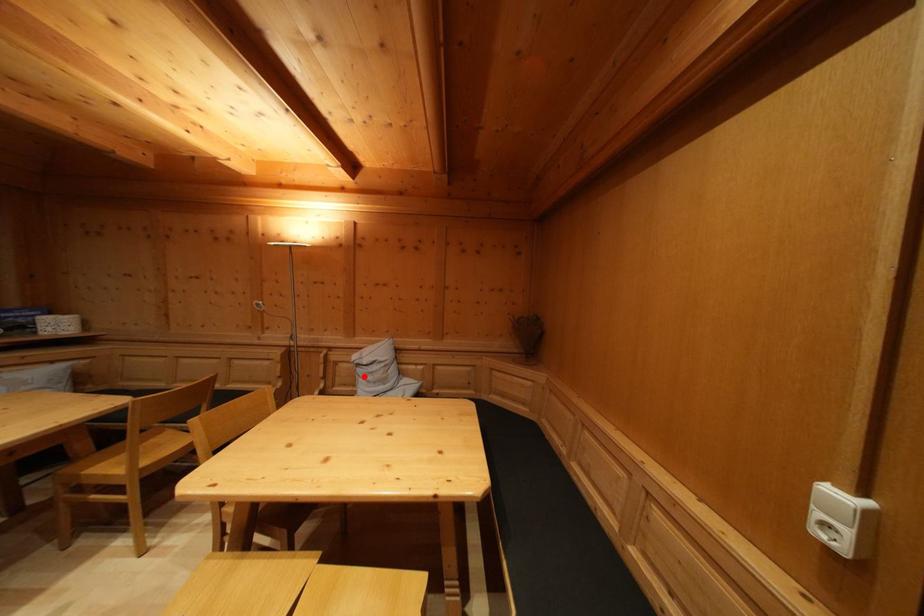
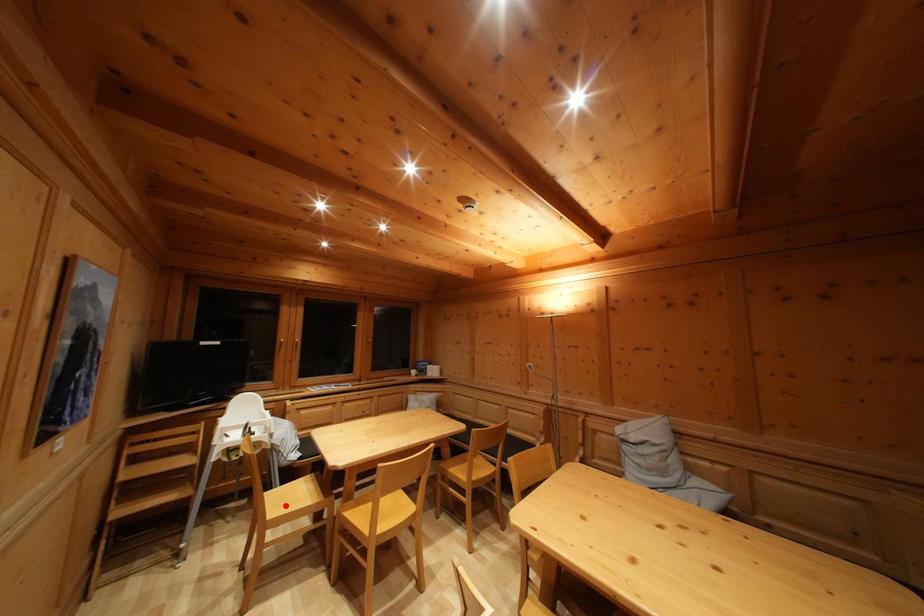
I am providing you with two images of the same scene from different viewpoints. A red point is marked on the first image and another point is marked on the second image. Does the point marked in image1 correspond to the same location as the one in image2?

No